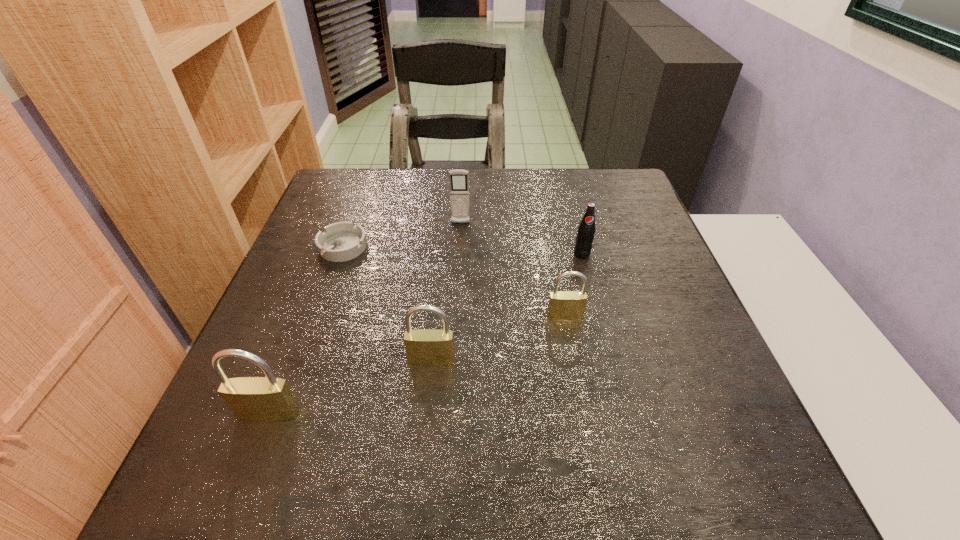
Locate an element on the screen. This screenshot has width=960, height=540. empty space between the second nearest padlock and the pop is located at coordinates (507, 307).

Identify the location of free spot between the farthest object and the shortest object. (401, 236).

Image resolution: width=960 pixels, height=540 pixels. Identify the location of the third closest object to the nearest object. (563, 305).

At what (x,y) coordinates should I click in order to perform the action: click on the fourth closest object to the leftmost padlock. Please return your answer as a coordinate pair (x, y). This screenshot has height=540, width=960. Looking at the image, I should click on (458, 178).

Locate an element on the screen. padlock that stands as the second closest to the nearest object is located at coordinates (563, 305).

Image resolution: width=960 pixels, height=540 pixels. I want to click on the third closest padlock to the farthest object, so click(252, 399).